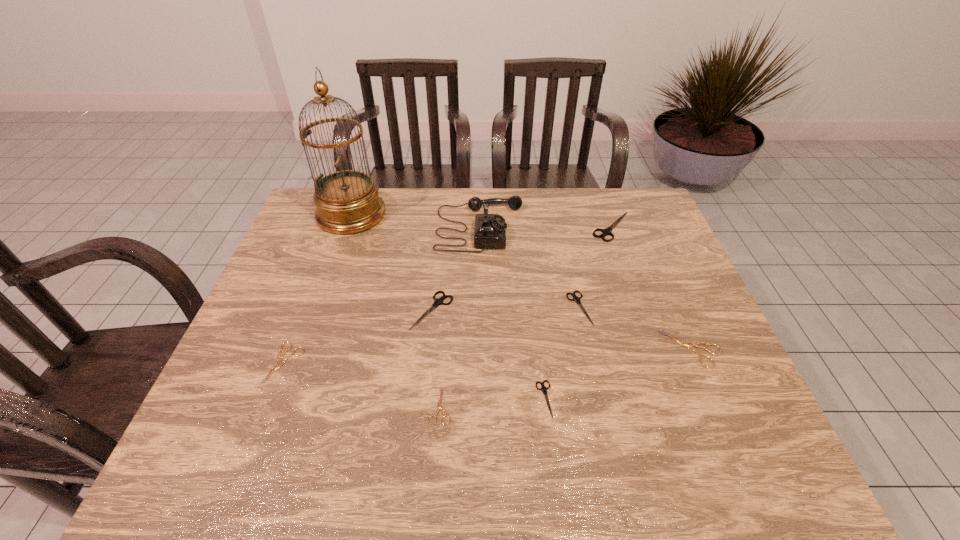
At what (x,y) coordinates should I click in order to perform the action: click on black shears that is the closest to the second beige shears from right to left. Please return your answer as a coordinate pair (x, y). Image resolution: width=960 pixels, height=540 pixels. Looking at the image, I should click on (439, 301).

Find the location of a particular element. Image resolution: width=960 pixels, height=540 pixels. black shears that is the fourth closest to the birdcage is located at coordinates (544, 389).

Select which beige shears appears as the second closest to the golden birdcage. Please provide its 2D coordinates. Your answer should be formatted as a tuple, i.e. [(x, y)], where the tuple contains the x and y coordinates of a point satisfying the conditions above.

[(439, 406)]

This screenshot has height=540, width=960. I want to click on beige shears that is the third closest one to the third black shears from right to left, so click(x=279, y=357).

Identify the location of free space in the image that satisfies the following two spatial constraints: 1. with an open door on the birdcage; 2. on the right side of the third object from right to left. The image size is (960, 540). (319, 308).

This screenshot has width=960, height=540. I want to click on free point that satisfies the following two spatial constraints: 1. on the back side of the rightmost beige shears; 2. with an open door on the birdcage, so click(634, 214).

Locate an element on the screen. vacant region that satisfies the following two spatial constraints: 1. on the front side of the second smallest beige shears; 2. on the left side of the smallest beige shears is located at coordinates (268, 406).

Where is `vacant area in the image that satisfies the following two spatial constraints: 1. on the back side of the second beige shears from left to right; 2. on the right side of the biggest beige shears`? Image resolution: width=960 pixels, height=540 pixels. vacant area in the image that satisfies the following two spatial constraints: 1. on the back side of the second beige shears from left to right; 2. on the right side of the biggest beige shears is located at coordinates (444, 348).